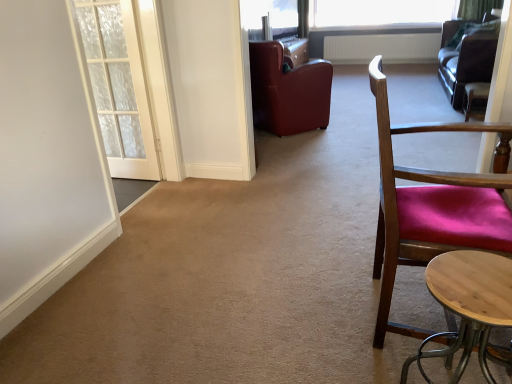
Image resolution: width=512 pixels, height=384 pixels. I want to click on white textured door at left, so click(x=119, y=87).

In order to face leather at center, marked as the 2th chair in a front-to-back arrangement, should I rotate leftwards or rightwards?

Turn right by 3.129 degrees to look at leather at center, marked as the 2th chair in a front-to-back arrangement.

Measure the distance between leather at center, arranged as the second chair when viewed from the back, and camera.

leather at center, arranged as the second chair when viewed from the back, is 11.68 feet from camera.

You are a GUI agent. You are given a task and a screenshot of the screen. Output one action in this format:
    pyautogui.click(x=<x>, y=<y>)
    Task: Click on the wooden chair with red cushion at right, which is the second chair in right-to-left order
    Image resolution: width=512 pixels, height=384 pixels.
    Given the screenshot: What is the action you would take?
    pyautogui.click(x=434, y=206)

Measure the distance between transparent glass window at upper center and camera.

The distance of transparent glass window at upper center from camera is 5.41 meters.

Locate an element on the screen. The width and height of the screenshot is (512, 384). leather couch at upper right is located at coordinates (465, 60).

Measure the distance between leather couch at upper right and camera.

leather couch at upper right and camera are 3.82 meters apart.

At what (x,y) coordinates should I click in order to perform the action: click on white textured door at left. Please return your answer as a coordinate pair (x, y). This screenshot has width=512, height=384. Looking at the image, I should click on (119, 87).

Can we say white textured door at left lies outside wooden chair with red cushion at right, which is the second chair in right-to-left order?

white textured door at left is positioned outside wooden chair with red cushion at right, which is the second chair in right-to-left order.

Is the depth of white textured door at left greater than that of wooden chair with red cushion at right, which is the second chair in right-to-left order?

Yes, it is.

Based on the photo, considering the positions of objects white textured door at left and wooden chair with red cushion at right, which is counted as the first chair, starting from the front, in the image provided, who is more to the right, white textured door at left or wooden chair with red cushion at right, which is counted as the first chair, starting from the front,?

wooden chair with red cushion at right, which is counted as the first chair, starting from the front, is more to the right.

Is transparent glass window at upper center facing towards transparent glass window screen at upper center?

Yes, transparent glass window at upper center is aimed at transparent glass window screen at upper center.

Is transparent glass window at upper center placed right next to transparent glass window screen at upper center?

transparent glass window at upper center is not next to transparent glass window screen at upper center, and they're not touching.

Which point is more distant from viewer, (451, 6) or (270, 12)?

Point (451, 6)

From the image's perspective, between transparent glass window at upper center and transparent glass window screen at upper center, which one is located above?

transparent glass window at upper center appears higher in the image.

Between leather at center, which is the first chair in left-to-right order, and white textured radiator at upper center, which one has larger width?

leather at center, which is the first chair in left-to-right order, is wider.

Is leather at center, which is the 3th chair in right-to-left order, inside or outside of white textured radiator at upper center?

leather at center, which is the 3th chair in right-to-left order, lies outside white textured radiator at upper center.

From the picture: Measure the distance between leather at center, which is the first chair in left-to-right order, and white textured radiator at upper center.

A distance of 7.88 feet exists between leather at center, which is the first chair in left-to-right order, and white textured radiator at upper center.

From the picture: Considering the positions of objects leather at center, which is the 3th chair in right-to-left order, and white textured radiator at upper center in the image provided, who is behind, leather at center, which is the 3th chair in right-to-left order, or white textured radiator at upper center?

white textured radiator at upper center is further from the camera.

How different are the orientations of transparent glass window at upper center and white textured radiator at upper center in degrees?

1.07 degrees.

Would you say white textured radiator at upper center is part of transparent glass window at upper center's contents?

No, white textured radiator at upper center is not a part of transparent glass window at upper center.

Does transparent glass window at upper center have a smaller size compared to white textured radiator at upper center?

Actually, transparent glass window at upper center might be larger than white textured radiator at upper center.

Which object is thinner, transparent glass window at upper center or white textured radiator at upper center?

Thinner between the two is white textured radiator at upper center.

Based on their positions, is leather at center, which is the 3th chair in right-to-left order, located to the left or right of transparent glass window at upper center?

Based on their positions, leather at center, which is the 3th chair in right-to-left order, is located to the left of transparent glass window at upper center.

The height and width of the screenshot is (384, 512). In order to click on the 2nd chair in front of the transparent glass window at upper center, starting your count from the anchor in this screenshot , I will do `click(288, 91)`.

Does leather at center, which is the first chair in left-to-right order, lie in front of transparent glass window at upper center?

Yes, leather at center, which is the first chair in left-to-right order, is in front of transparent glass window at upper center.

How far apart are leather at center, marked as the 2th chair in a front-to-back arrangement, and transparent glass window at upper center?

leather at center, marked as the 2th chair in a front-to-back arrangement, and transparent glass window at upper center are 2.29 meters apart.

How many degrees apart are the facing directions of white textured radiator at upper center and light wood round table at lower right?

The angular difference between white textured radiator at upper center and light wood round table at lower right is 86.9 degrees.

Is white textured radiator at upper center facing away from light wood round table at lower right?

No, white textured radiator at upper center is not facing the opposite direction of light wood round table at lower right.

Based on their positions, is white textured radiator at upper center located to the left or right of light wood round table at lower right?

Clearly, white textured radiator at upper center is on the right of light wood round table at lower right in the image.

In the image, there is a velvet burgundy chair at right, arranged as the third chair when viewed from the left. At what (x,y) coordinates should I click in order to perform the action: click on door below it (from the image's perspective). Please return your answer as a coordinate pair (x, y). Looking at the image, I should click on (119, 87).

Which object is positioned more to the left, white textured door at left or velvet burgundy chair at right, which is counted as the 3th chair, starting from the front?

white textured door at left.

From a real-world perspective, between white textured door at left and velvet burgundy chair at right, which is counted as the 3th chair, starting from the front, who is vertically lower?

velvet burgundy chair at right, which is counted as the 3th chair, starting from the front, from a real-world perspective.

At what (x,y) coordinates should I click in order to perform the action: click on door that appears above the wooden chair with red cushion at right, which is the second chair in right-to-left order (from the image's perspective). Please return your answer as a coordinate pair (x, y). Looking at the image, I should click on (119, 87).

Identify the location of window that is on the right side of transparent glass window screen at upper center. The height and width of the screenshot is (384, 512). (380, 12).

Based on their spatial positions, is leather couch at upper right or leather at center, which is the first chair in left-to-right order, closer to light wood round table at lower right?

leather at center, which is the first chair in left-to-right order, is closer to light wood round table at lower right.

Which object lies further to the anchor point leather at center, marked as the 2th chair in a front-to-back arrangement, transparent glass window screen at upper center or leather couch at upper right?

Among the two, leather couch at upper right is located further to leather at center, marked as the 2th chair in a front-to-back arrangement.

Based on their spatial positions, is transparent glass window screen at upper center or transparent glass window at upper center further from white textured door at left?

transparent glass window at upper center is further to white textured door at left.

Based on the photo, looking at the image, which one is located closer to leather at center, marked as the 2th chair in a front-to-back arrangement, white textured door at left or wooden chair with red cushion at right, which is counted as the first chair, starting from the front?

white textured door at left is positioned closer to the anchor leather at center, marked as the 2th chair in a front-to-back arrangement.

From the image, which object appears to be nearer to velvet burgundy chair at right, the 1th chair in the back-to-front sequence, transparent glass window at upper center or transparent glass window screen at upper center?

transparent glass window at upper center is positioned closer to the anchor velvet burgundy chair at right, the 1th chair in the back-to-front sequence.

Looking at the image, which one is located closer to wooden chair with red cushion at right, the third chair in the back-to-front sequence, white textured door at left or leather at center, arranged as the second chair when viewed from the back?

white textured door at left is positioned closer to the anchor wooden chair with red cushion at right, the third chair in the back-to-front sequence.

Looking at the image, which one is located further to transparent glass window at upper center, white textured radiator at upper center or leather couch at upper right?

The object further to transparent glass window at upper center is leather couch at upper right.

Which object lies nearer to the anchor point leather couch at upper right, white sheer curtain at upper right or white textured radiator at upper center?

The object closer to leather couch at upper right is white sheer curtain at upper right.

At what (x,y) coordinates should I click in order to perform the action: click on radiator between transparent glass window screen at upper center and white sheer curtain at upper right from left to right. Please return your answer as a coordinate pair (x, y). The height and width of the screenshot is (384, 512). Looking at the image, I should click on (382, 48).

Find the location of `window screen between wooden chair with red cushion at right, which is counted as the first chair, starting from the front, and transparent glass window at upper center, along the z-axis`. window screen between wooden chair with red cushion at right, which is counted as the first chair, starting from the front, and transparent glass window at upper center, along the z-axis is located at coordinates (270, 18).

The image size is (512, 384). Identify the location of window screen located between leather at center, which is the first chair in left-to-right order, and white textured radiator at upper center in the depth direction. (270, 18).

At what (x,y) coordinates should I click in order to perform the action: click on studio couch between light wood round table at lower right and transparent glass window at upper center from front to back. Please return your answer as a coordinate pair (x, y). This screenshot has width=512, height=384. Looking at the image, I should click on (465, 60).